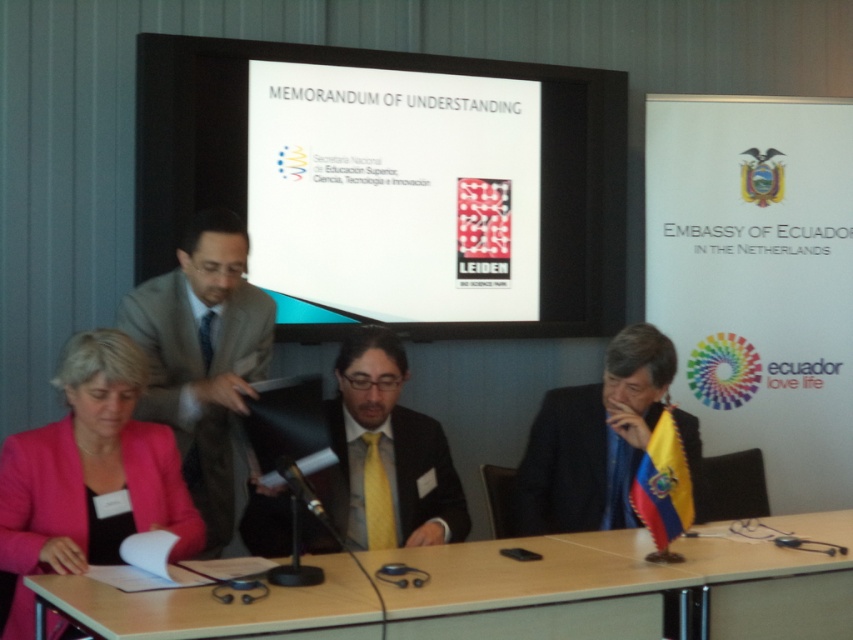
You are a service robot with a 1.2 meter arm reach. You need to hand a document to the person in the light gray wool suit at left from the black matte suit at center. Can your arm reach them?

The distance between light gray wool suit at left and black matte suit at center is 1.24 meters. Since your arm can reach 1.2 meters, you cannot quite reach them.

In the formal meeting scene, there are two men wearing different suits. The first is wearing a light gray wool suit at left, and the second is in a black matte suit at center. From the perspective of someone sitting at the head of the table, which suit is closer to the edge of the table?

The light gray wool suit at left is positioned over the black matte suit at center, so from the head of the table, the light gray wool suit at left is closer to the edge of the table.